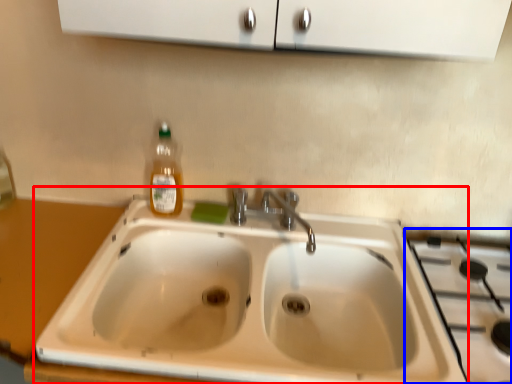
Question: Which object appears farthest to the camera in this image, sink (highlighted by a red box) or gas stove (highlighted by a blue box)?

Choices:
 (A) sink
 (B) gas stove

Answer: (B)